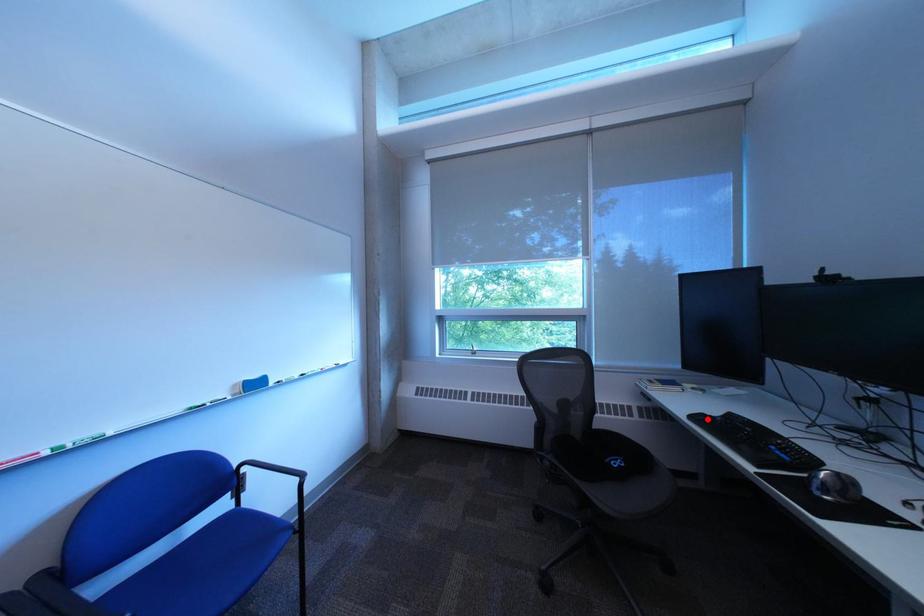
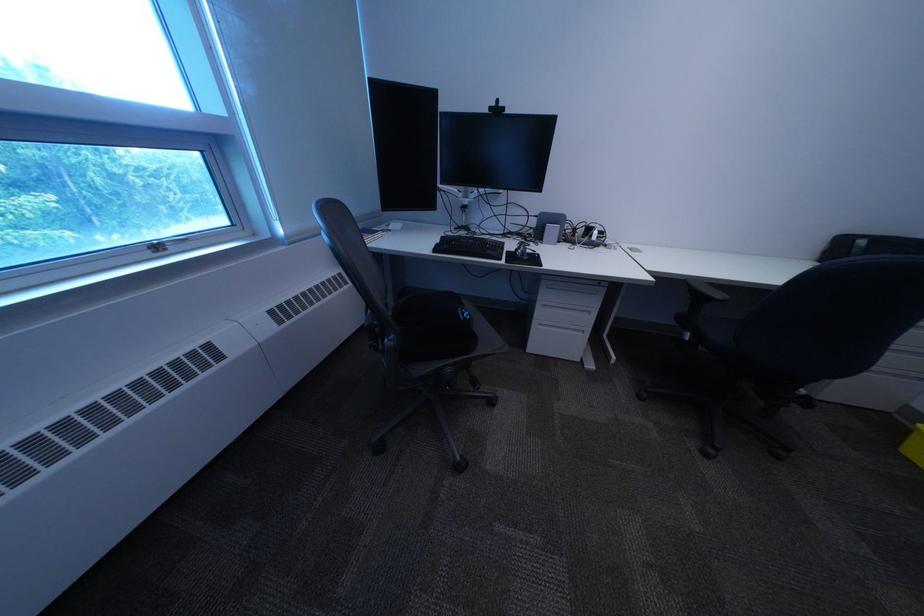
Locate, in the second image, the point that corresponds to the highlighted location in the first image.

(451, 252)